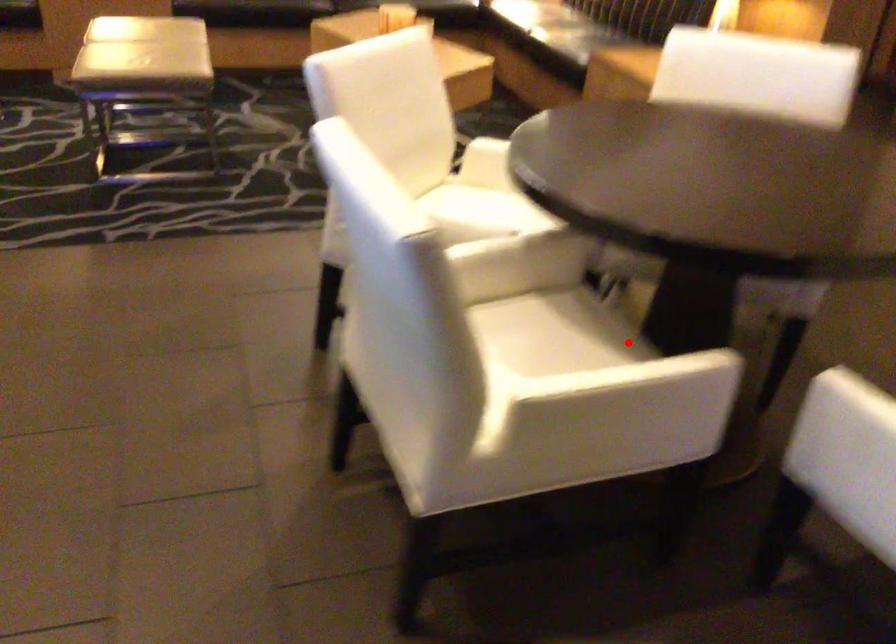
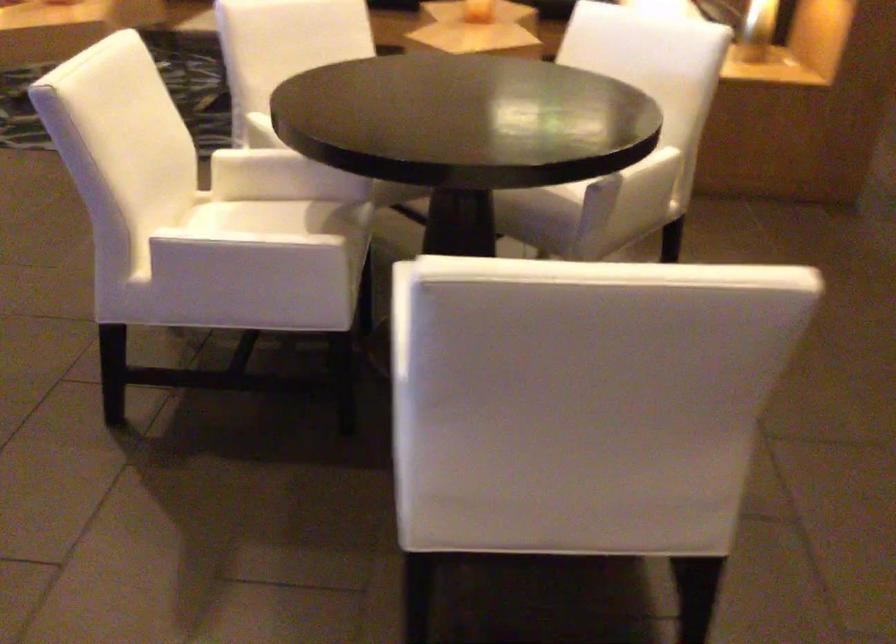
Find the pixel in the second image that matches the highlighted location in the first image.

(347, 240)